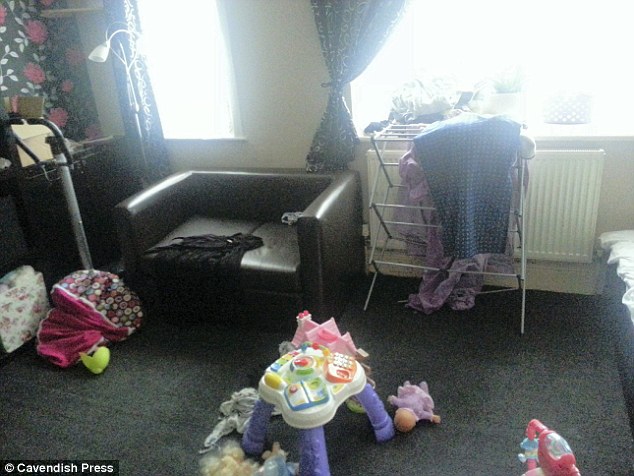
Identify the location of lighting for room. This screenshot has width=634, height=476. (98, 49).